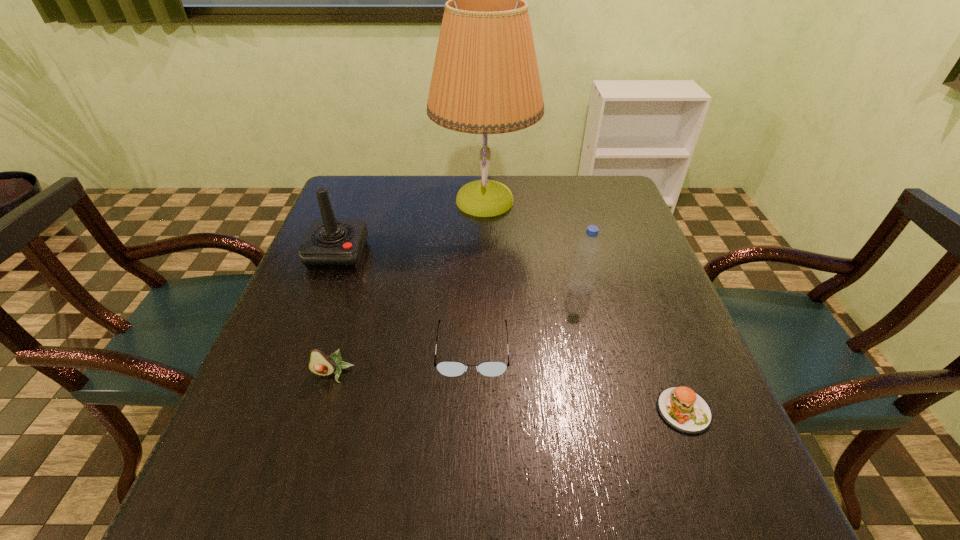
Identify which object is the second nearest to the spectacles. Please provide its 2D coordinates. Your answer should be formatted as a tuple, i.e. [(x, y)], where the tuple contains the x and y coordinates of a point satisfying the conditions above.

[(582, 280)]

Locate an element on the screen. This screenshot has height=540, width=960. vacant region that satisfies the following two spatial constraints: 1. on the side of the lamp near the pull switch; 2. on the back side of the nearest object is located at coordinates (488, 410).

Find the location of a particular element. The width and height of the screenshot is (960, 540). free spot that satisfies the following two spatial constraints: 1. on the side of the lamp near the pull switch; 2. on the lenses of the spectacles is located at coordinates (487, 349).

The image size is (960, 540). Identify the location of vacant region that satisfies the following two spatial constraints: 1. on the side of the lamp near the pull switch; 2. on the front-facing side of the fifth nearest object. (486, 254).

Find the location of `vacant space that satisfies the following two spatial constraints: 1. on the back side of the shortest object; 2. on the side of the tallest object near the pull switch`. vacant space that satisfies the following two spatial constraints: 1. on the back side of the shortest object; 2. on the side of the tallest object near the pull switch is located at coordinates (603, 200).

The height and width of the screenshot is (540, 960). Find the location of `free space that satisfies the following two spatial constraints: 1. on the side of the lamp near the pull switch; 2. on the right side of the second object from right to left`. free space that satisfies the following two spatial constraints: 1. on the side of the lamp near the pull switch; 2. on the right side of the second object from right to left is located at coordinates (486, 290).

Find the location of a particular element. Image resolution: width=960 pixels, height=540 pixels. free space that satisfies the following two spatial constraints: 1. on the side of the lamp near the pull switch; 2. on the back side of the nearest object is located at coordinates (488, 410).

Locate an element on the screen. The width and height of the screenshot is (960, 540). vacant space that satisfies the following two spatial constraints: 1. on the side of the tallest object near the pull switch; 2. on the seed side of the third shortest object is located at coordinates (488, 374).

Image resolution: width=960 pixels, height=540 pixels. Find the location of `vacant space that satisfies the following two spatial constraints: 1. on the side of the second object from right to left near the pull switch; 2. on the left side of the lamp`. vacant space that satisfies the following two spatial constraints: 1. on the side of the second object from right to left near the pull switch; 2. on the left side of the lamp is located at coordinates (486, 290).

The image size is (960, 540). Find the location of `vacant point that satisfies the following two spatial constraints: 1. on the front side of the patty; 2. on the left side of the bottle`. vacant point that satisfies the following two spatial constraints: 1. on the front side of the patty; 2. on the left side of the bottle is located at coordinates (610, 410).